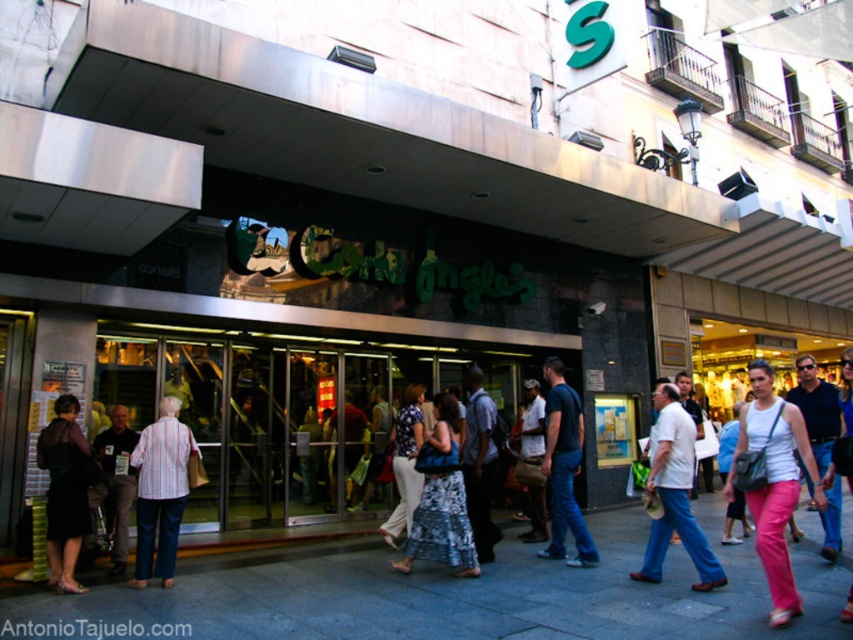
Can you confirm if printed fabric dress at center is taller than pink cotton pants at lower right?

Yes.

Between point (436, 524) and point (817, 406), which one is positioned in front?

Point (436, 524) is in front.

You are a GUI agent. You are given a task and a screenshot of the screen. Output one action in this format:
    pyautogui.click(x=<x>, y=<y>)
    Task: Click on the printed fabric dress at center
    Image resolution: width=853 pixels, height=640 pixels.
    Given the screenshot: What is the action you would take?
    pyautogui.click(x=440, y=500)

Is printed fabric dress at center positioned at the back of striped shirt at center?

No, printed fabric dress at center is in front of striped shirt at center.

Is point (434, 438) less distant than point (100, 464)?

That is True.

What are the coordinates of `printed fabric dress at center` in the screenshot? It's located at (440, 500).

Does white cotton shirt at center come behind striped cotton shirt at center?

No, it is not.

Does white cotton shirt at center have a greater height compared to striped cotton shirt at center?

Correct, white cotton shirt at center is much taller as striped cotton shirt at center.

Which is behind, point (683, 490) or point (178, 468)?

Positioned behind is point (178, 468).

Find the location of a particular element. This screenshot has height=640, width=853. white cotton shirt at center is located at coordinates (674, 492).